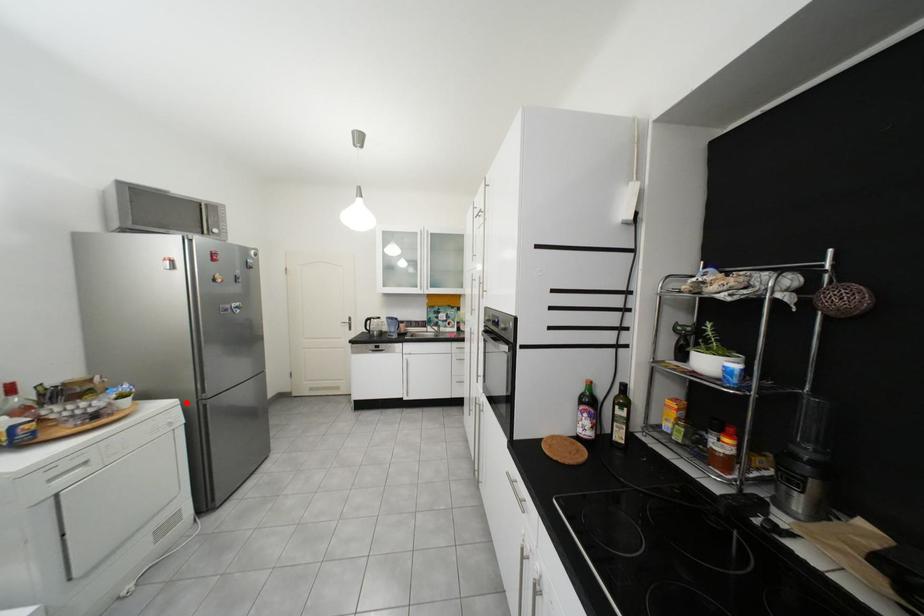
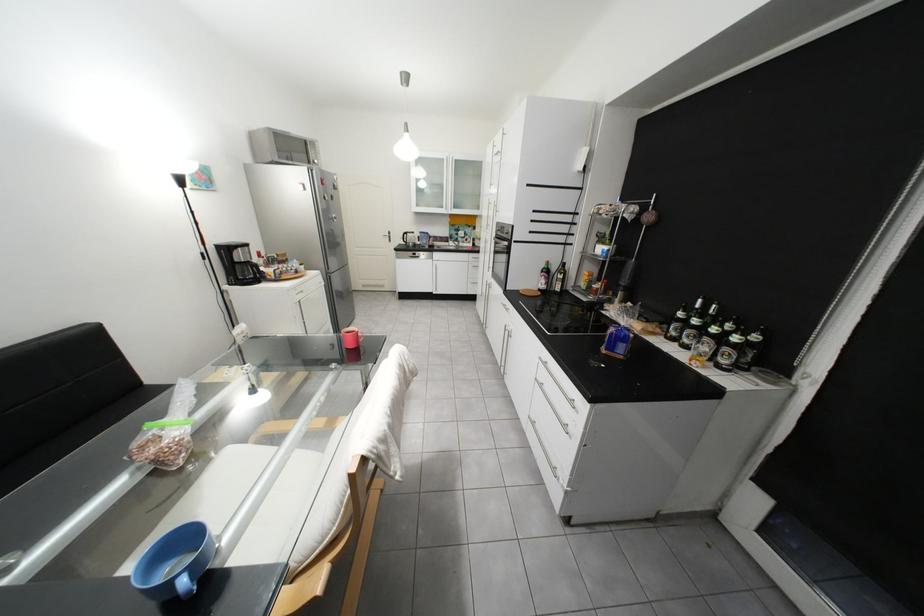
The point at the highlighted location is marked in the first image. Where is the corresponding point in the second image?

(330, 273)